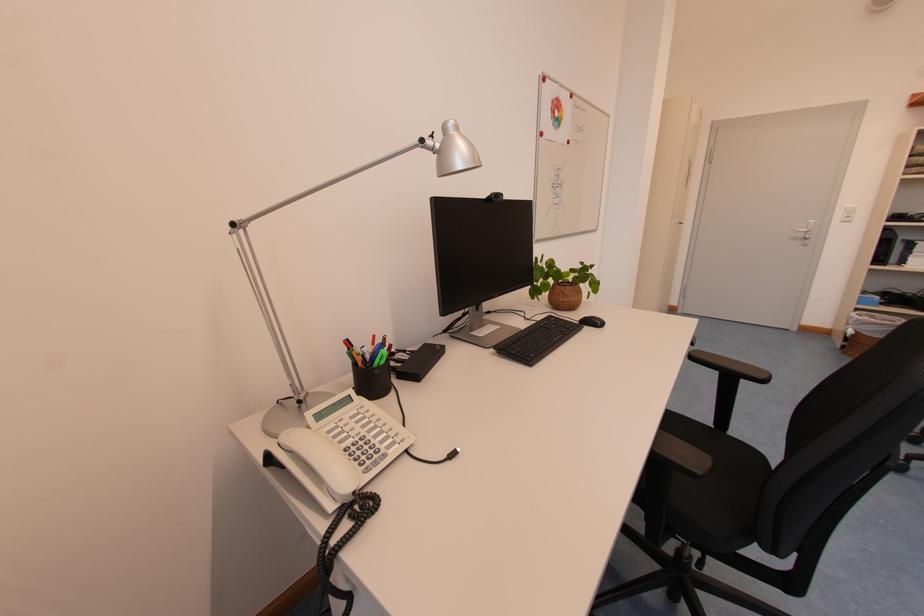
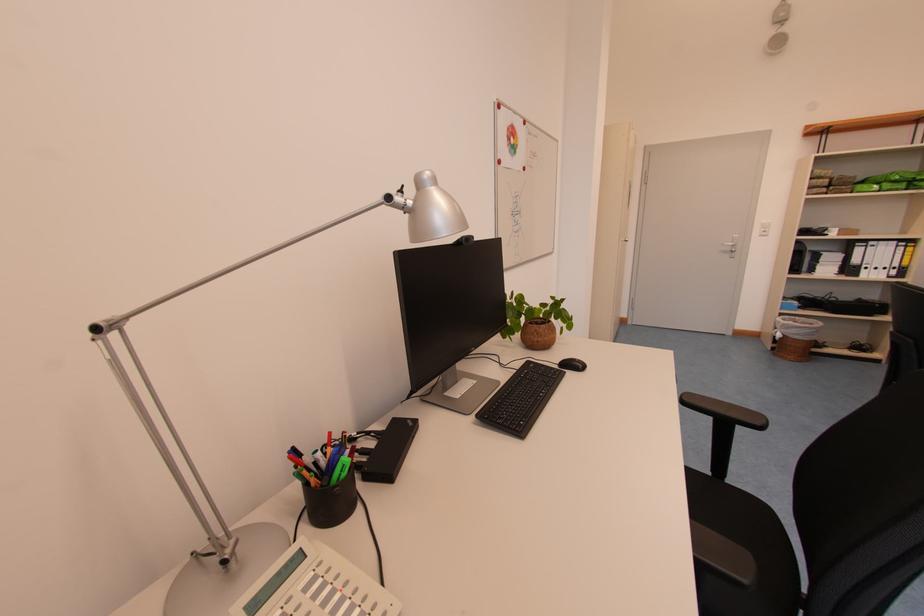
The point at (883,317) is marked in the first image. Where is the corresponding point in the second image?

(805, 321)